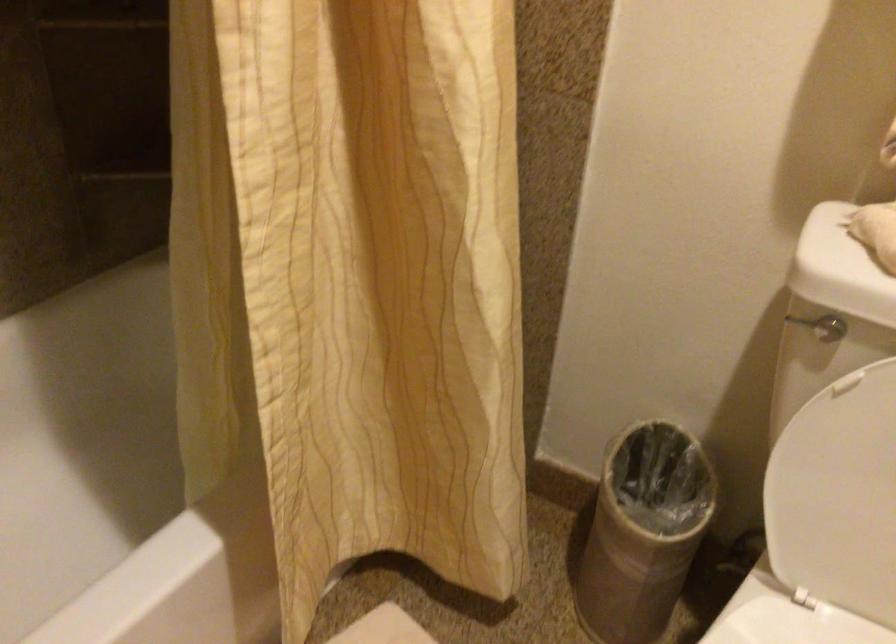
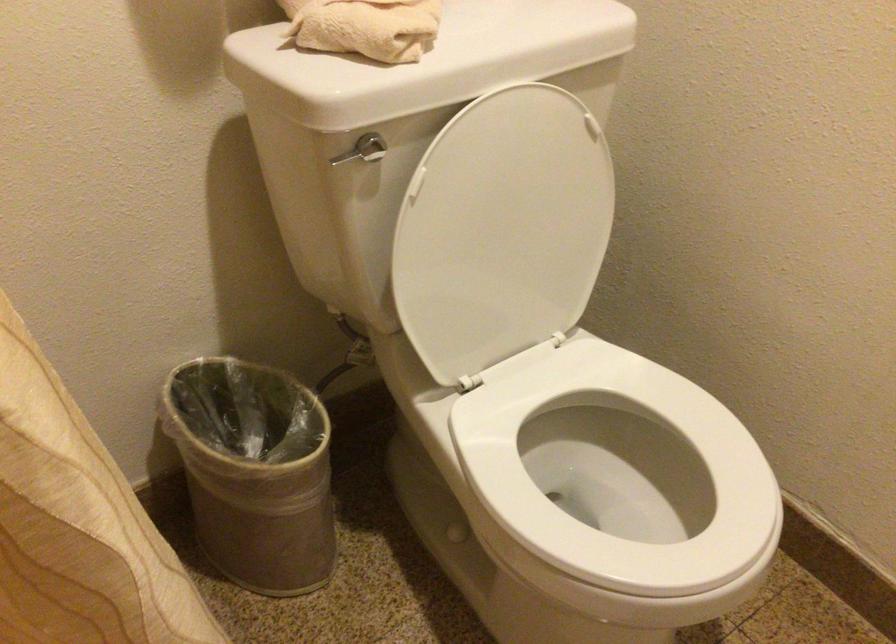
Where in the second image is the point corresponding to point (804, 319) from the first image?

(348, 155)